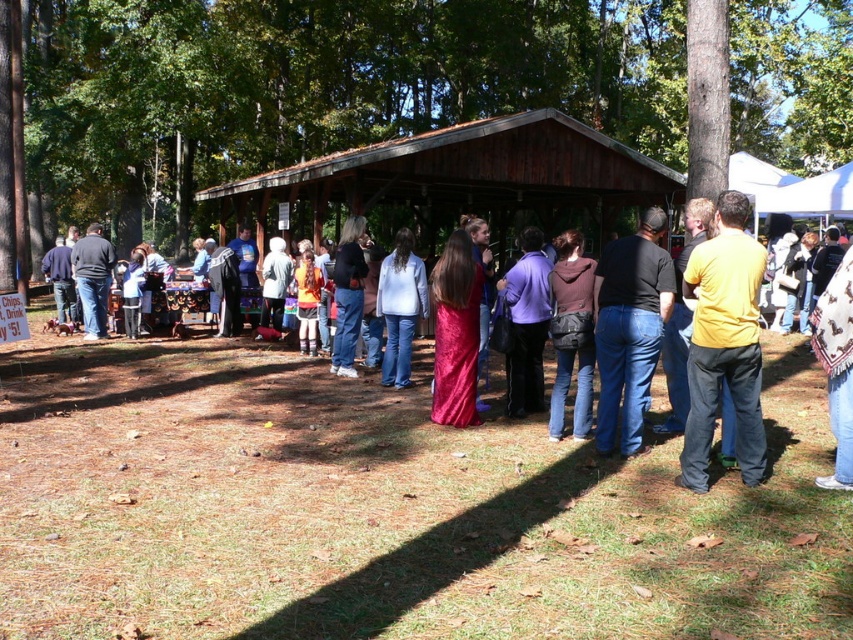
Question: Which point is closer to the camera taking this photo?

Choices:
 (A) (543, 568)
 (B) (102, 232)
 (C) (596, 314)
 (D) (403, 384)

Answer: (A)

Question: Is matte black shirt at center to the left of matte black jacket at left from the viewer's perspective?

Choices:
 (A) no
 (B) yes

Answer: (A)

Question: Which point is farther to the camera?

Choices:
 (A) matte black jacket at left
 (B) matte black shirt at center

Answer: (A)

Question: Among these points, which one is farthest from the camera?

Choices:
 (A) (97, 240)
 (B) (402, 333)
 (C) (704, 310)

Answer: (A)

Question: Can you confirm if dark brown leather jacket at center is thinner than matte black jacket at left?

Choices:
 (A) yes
 (B) no

Answer: (A)

Question: Does yellow matte shirt at center come behind matte white shirt at center?

Choices:
 (A) yes
 (B) no

Answer: (B)